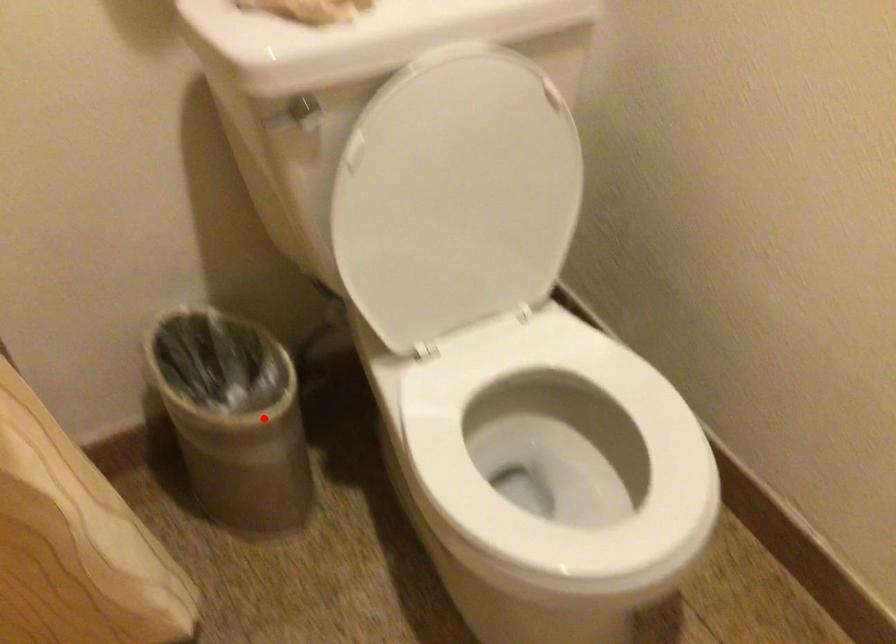
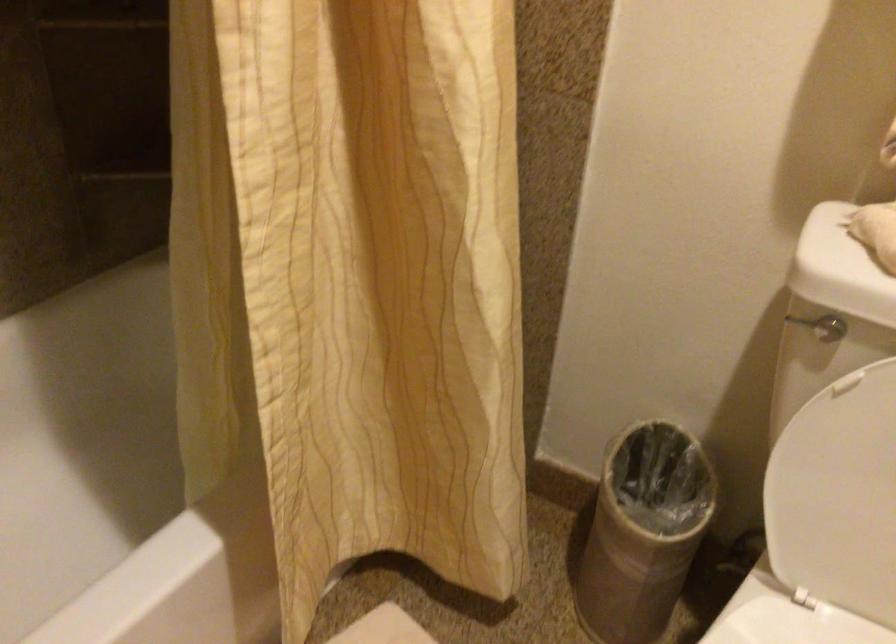
Where in the second image is the point corresponding to the highlighted location from the first image?

(643, 532)